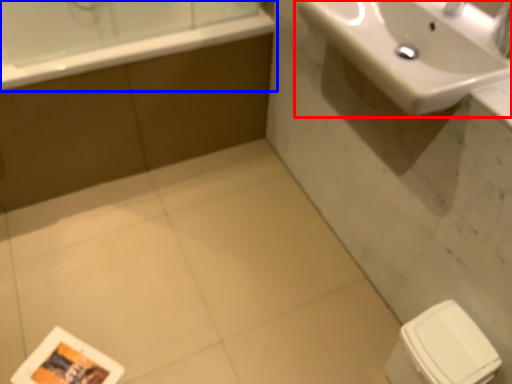
Question: Which point is closer to the camera, sink (highlighted by a red box) or bathtub (highlighted by a blue box)?

Choices:
 (A) sink
 (B) bathtub

Answer: (A)